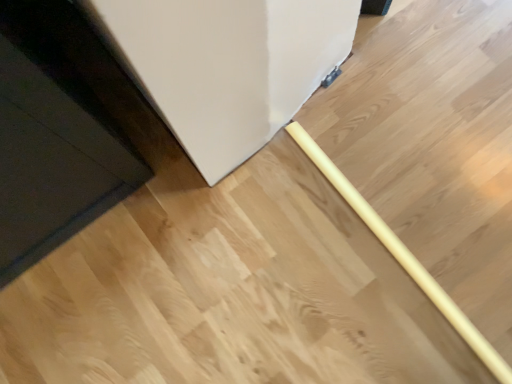
Question: Is yellow wood rolling pin at center positioned with its back to black glossy door at lower left?

Choices:
 (A) no
 (B) yes

Answer: (A)

Question: Can you confirm if yellow wood rolling pin at center is wider than black glossy door at lower left?

Choices:
 (A) no
 (B) yes

Answer: (A)

Question: Is yellow wood rolling pin at center shorter than black glossy door at lower left?

Choices:
 (A) yes
 (B) no

Answer: (A)

Question: Is yellow wood rolling pin at center far away from black glossy door at lower left?

Choices:
 (A) yes
 (B) no

Answer: (B)

Question: Could you tell me if yellow wood rolling pin at center is turned towards black glossy door at lower left?

Choices:
 (A) no
 (B) yes

Answer: (A)

Question: Does yellow wood rolling pin at center appear on the left side of black glossy door at lower left?

Choices:
 (A) no
 (B) yes

Answer: (A)

Question: Considering the relative positions of black glossy door at lower left and yellow wood rolling pin at center in the image provided, is black glossy door at lower left behind yellow wood rolling pin at center?

Choices:
 (A) no
 (B) yes

Answer: (A)

Question: Is black glossy door at lower left looking in the opposite direction of yellow wood rolling pin at center?

Choices:
 (A) no
 (B) yes

Answer: (A)

Question: Is black glossy door at lower left taller than yellow wood rolling pin at center?

Choices:
 (A) yes
 (B) no

Answer: (A)

Question: Is black glossy door at lower left facing towards yellow wood rolling pin at center?

Choices:
 (A) yes
 (B) no

Answer: (B)

Question: Can we say black glossy door at lower left lies outside yellow wood rolling pin at center?

Choices:
 (A) no
 (B) yes

Answer: (B)

Question: Is black glossy door at lower left wider than yellow wood rolling pin at center?

Choices:
 (A) no
 (B) yes

Answer: (B)

Question: Visually, is yellow wood rolling pin at center positioned to the left or to the right of black glossy door at lower left?

Choices:
 (A) right
 (B) left

Answer: (A)